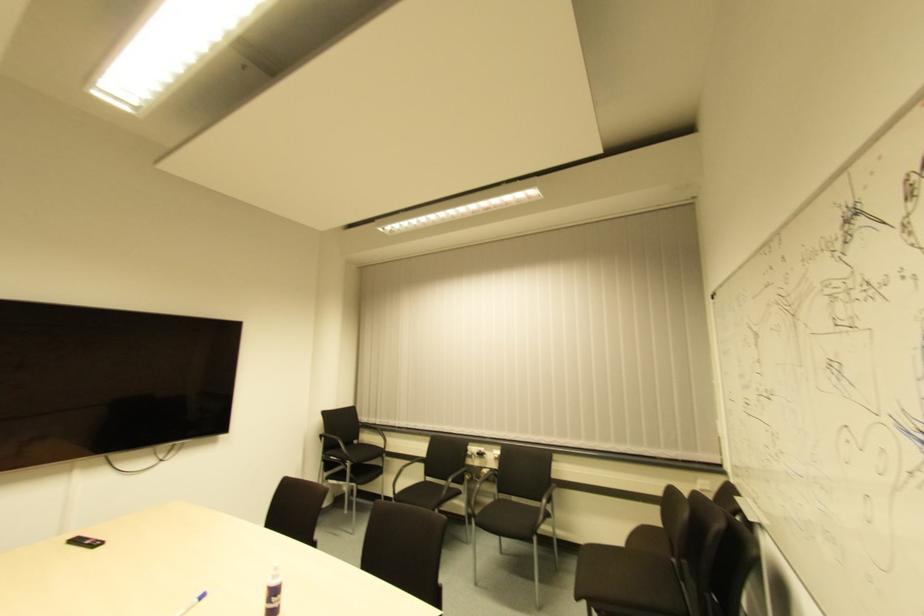
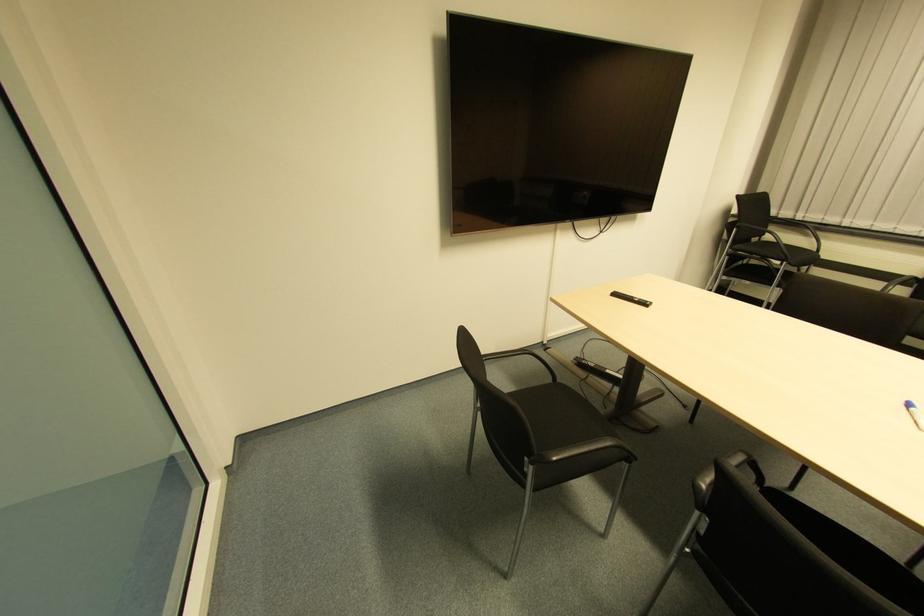
The point at (353, 445) is marked in the first image. Where is the corresponding point in the second image?

(752, 243)